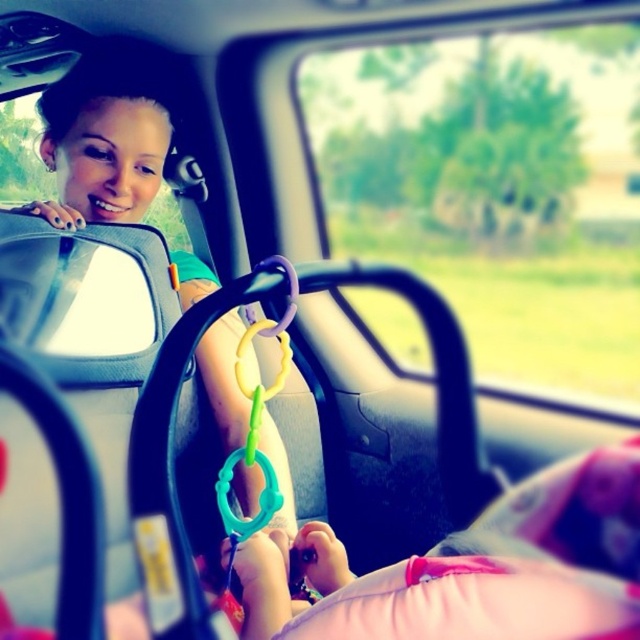
Can you confirm if transparent glass car window at center is positioned below matte black hair at upper left?

Incorrect, transparent glass car window at center is not positioned below matte black hair at upper left.

Can you confirm if transparent glass car window at center is shorter than matte black hair at upper left?

Yes, transparent glass car window at center is shorter than matte black hair at upper left.

Is point (349, 189) more distant than point (141, 168)?

Yes.

The image size is (640, 640). Identify the location of transparent glass car window at center. (497, 189).